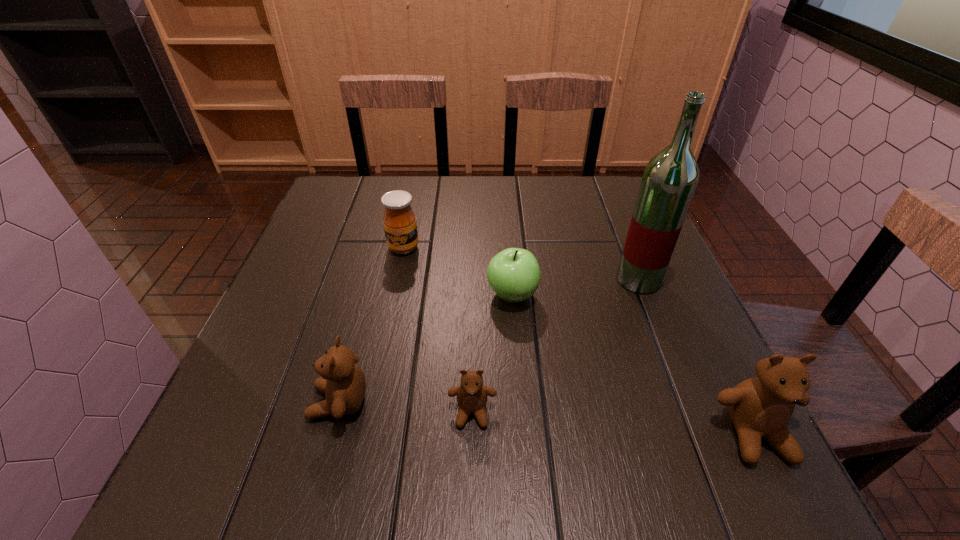
Select which object is the third closest to the second shortest object. Please provide its 2D coordinates. Your answer should be formatted as a tuple, i.e. [(x, y)], where the tuple contains the x and y coordinates of a point satisfying the conditions above.

[(472, 395)]

Point out which object is positioned as the third nearest to the rightmost teddy bear. Please provide its 2D coordinates. Your answer should be formatted as a tuple, i.e. [(x, y)], where the tuple contains the x and y coordinates of a point satisfying the conditions above.

[(472, 395)]

Identify the location of teddy bear that stands as the second closest to the second teddy bear from right to left. (760, 407).

You are a GUI agent. You are given a task and a screenshot of the screen. Output one action in this format:
    pyautogui.click(x=<x>, y=<y>)
    Task: Click on the teddy bear that stands as the closest to the farthest object
    The image size is (960, 540).
    Given the screenshot: What is the action you would take?
    pyautogui.click(x=342, y=381)

This screenshot has width=960, height=540. What are the coordinates of `vacant area that satisfies the following two spatial constraints: 1. on the front-facing side of the liquor; 2. on the right side of the farthest object` in the screenshot? It's located at (397, 280).

At what (x,y) coordinates should I click in order to perform the action: click on free space that satisfies the following two spatial constraints: 1. on the front-facing side of the liquor; 2. on the left side of the farthest object. Please return your answer as a coordinate pair (x, y). This screenshot has height=540, width=960. Looking at the image, I should click on (397, 280).